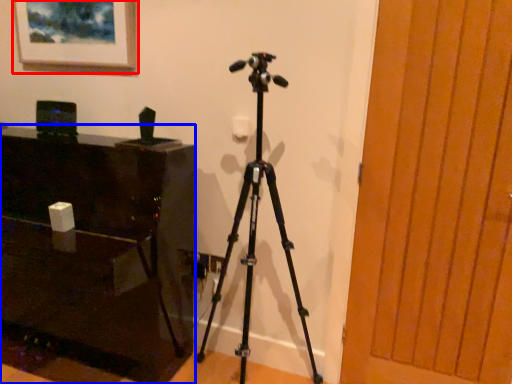
Question: Which object is closer to the camera taking this photo, picture frame (highlighted by a red box) or furniture (highlighted by a blue box)?

Choices:
 (A) picture frame
 (B) furniture

Answer: (B)